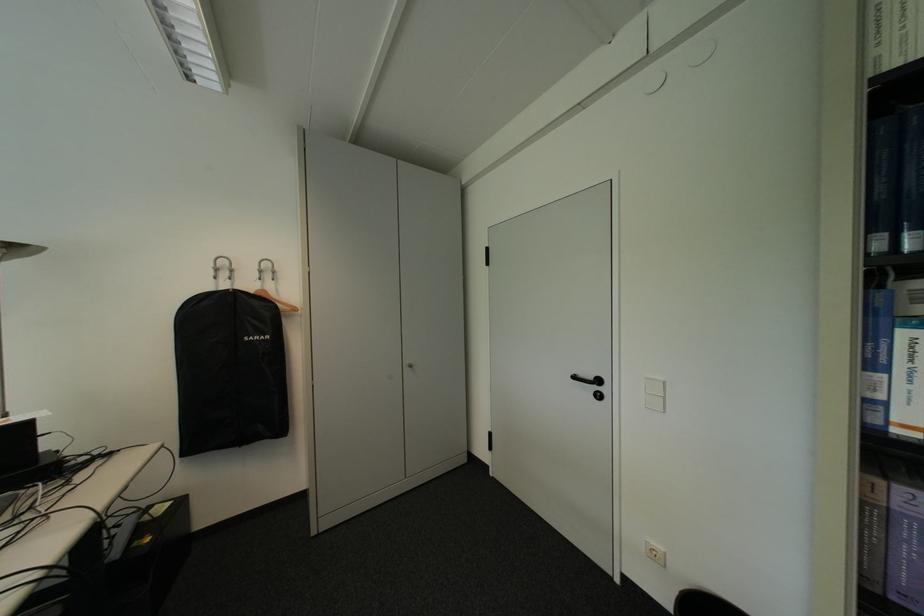
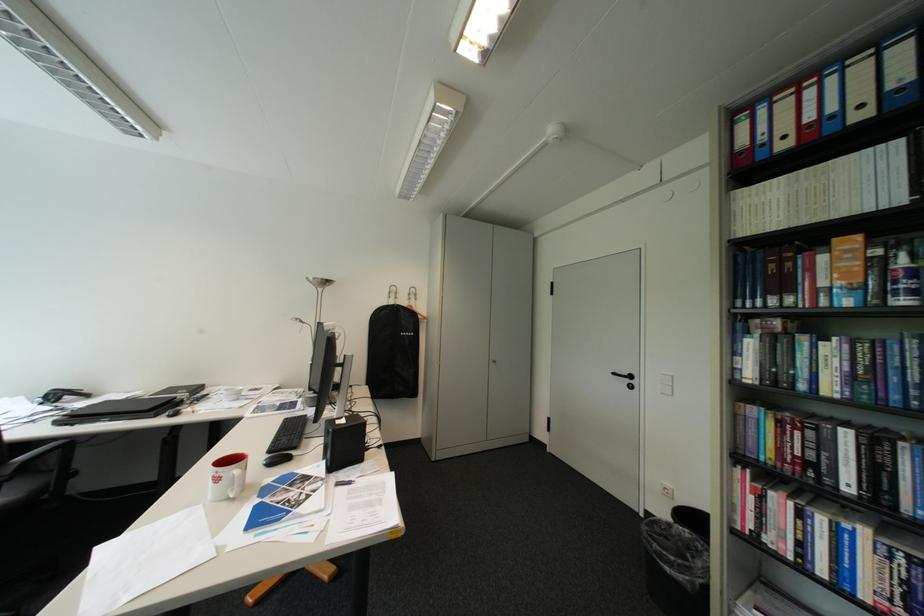
Locate, in the second image, the point that corresponds to the point at 244,270 in the first image.

(408, 294)